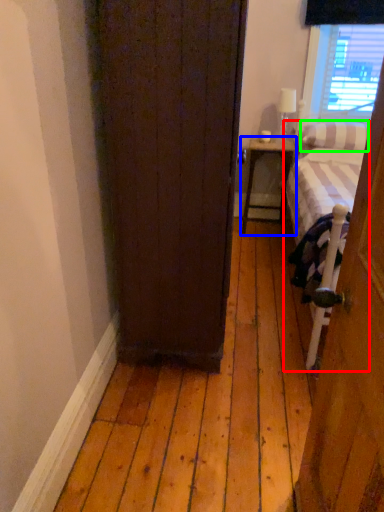
Question: Considering the real-world distances, which object is closest to bed (highlighted by a red box)? nightstand (highlighted by a blue box) or pillow (highlighted by a green box).

Choices:
 (A) nightstand
 (B) pillow

Answer: (B)